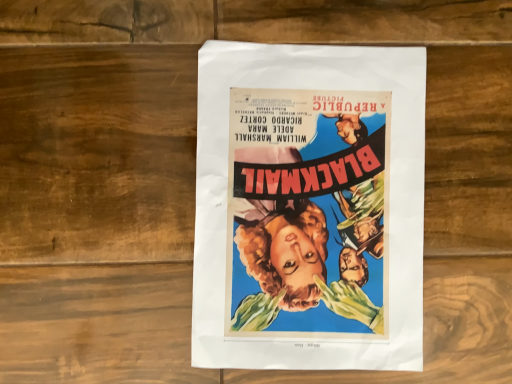
The height and width of the screenshot is (384, 512). Describe the element at coordinates (309, 207) in the screenshot. I see `vibrant paper poster at center` at that location.

This screenshot has height=384, width=512. Identify the location of vibrant paper poster at center. (309, 207).

Identify the location of vibrant paper poster at center. (309, 207).